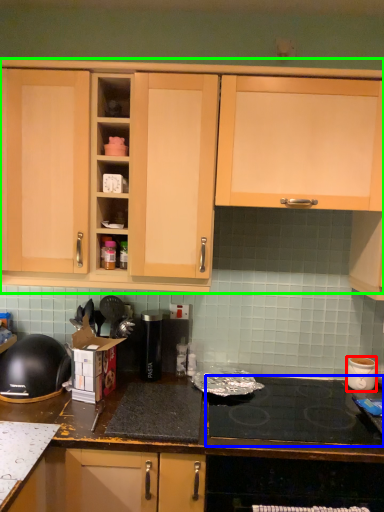
Question: Which object is the farthest from kitchen appliance (highlighted by a red box)? Choose among these: gas stove (highlighted by a blue box) or cabinetry (highlighted by a green box).

Choices:
 (A) gas stove
 (B) cabinetry

Answer: (B)